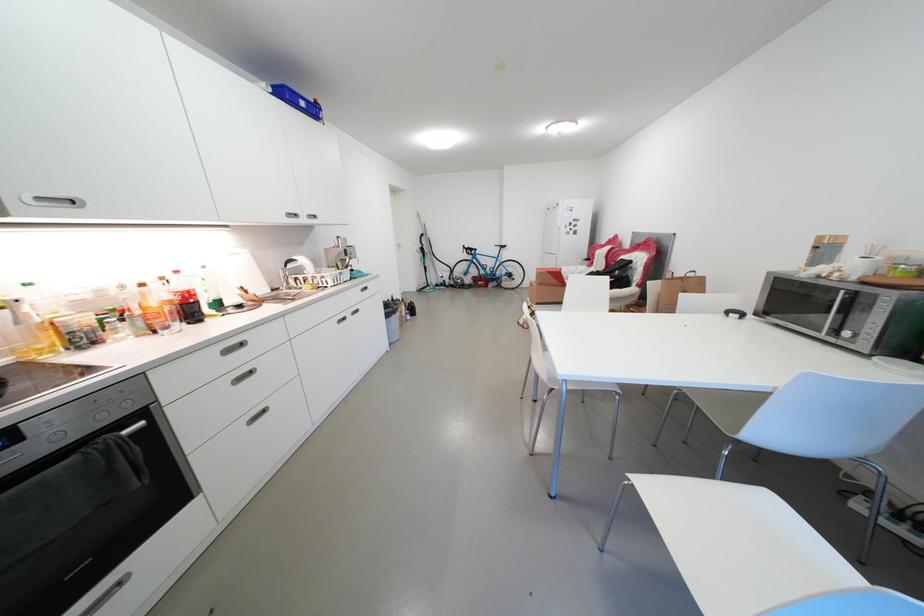
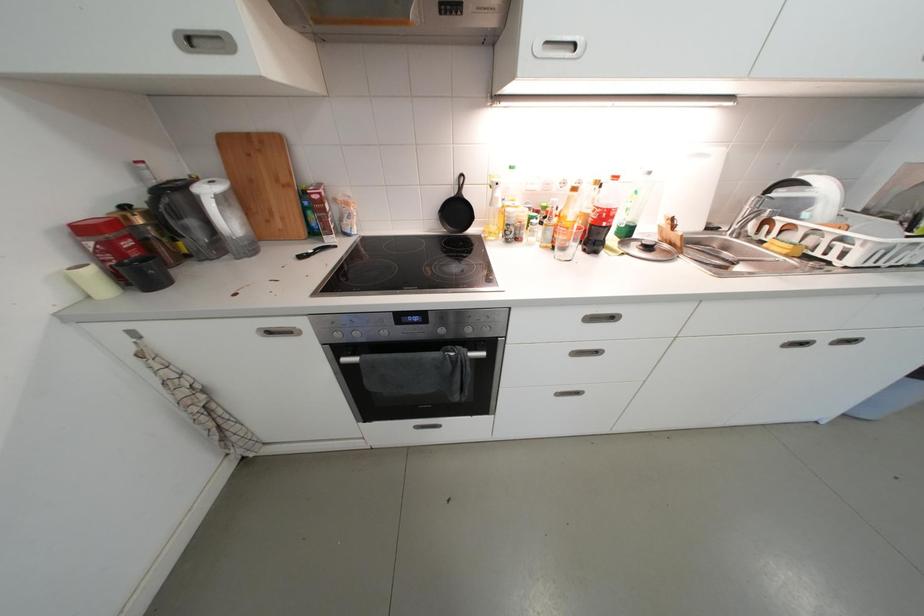
Based on the continuous images, in which direction is the camera rotating?

The rotation direction of the camera is left-down.